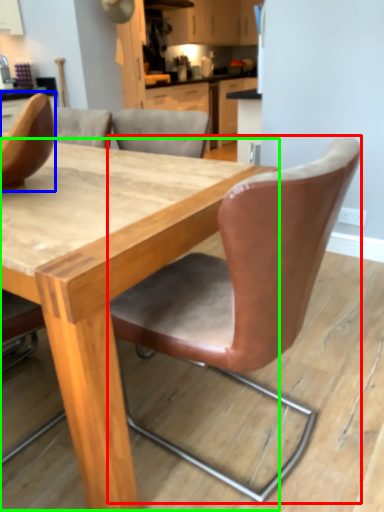
Question: Estimate the real-world distances between objects in this image. Which object is closer to chair (highlighted by a red box), chair (highlighted by a blue box) or table (highlighted by a green box)?

Choices:
 (A) chair
 (B) table

Answer: (B)